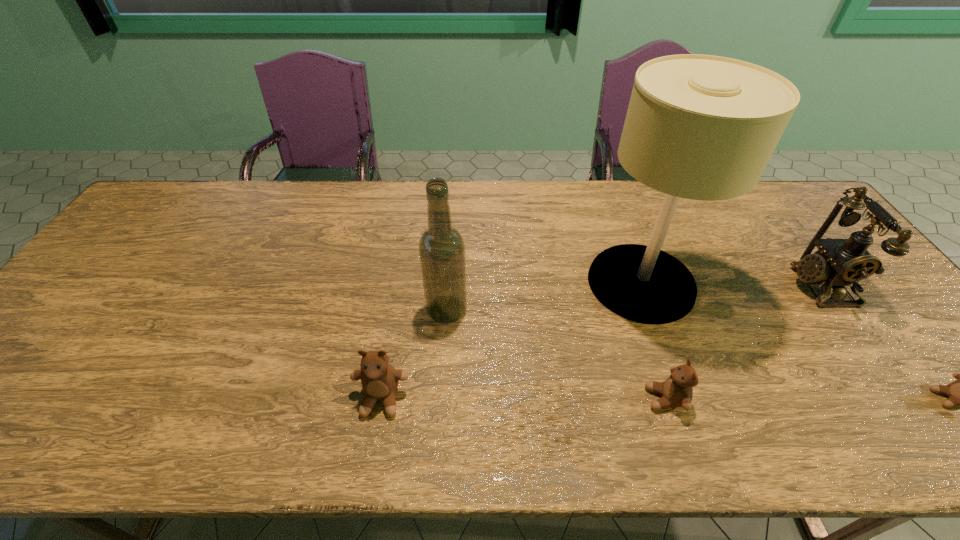
Image resolution: width=960 pixels, height=540 pixels. What are the coordinates of `object that is the fifth nearest to the third tallest object` in the screenshot? It's located at pos(379,380).

The height and width of the screenshot is (540, 960). Identify the location of teddy bear that stands as the closest to the table lamp. (676, 391).

The image size is (960, 540). Find the location of `teddy bear that stands as the second closest to the fifth tallest object`. teddy bear that stands as the second closest to the fifth tallest object is located at coordinates (959, 392).

The height and width of the screenshot is (540, 960). Find the location of `free point that satisfies the following two spatial constraints: 1. on the rotary dial of the fourth shortest object; 2. on the front-facing side of the leftmost object`. free point that satisfies the following two spatial constraints: 1. on the rotary dial of the fourth shortest object; 2. on the front-facing side of the leftmost object is located at coordinates (901, 399).

Identify the location of free space that satisfies the following two spatial constraints: 1. on the rotary dial of the telephone; 2. on the front side of the second tallest object. (837, 310).

Locate an element on the screen. The height and width of the screenshot is (540, 960). free space that satisfies the following two spatial constraints: 1. on the rotary dial of the third tallest object; 2. on the front side of the liquor is located at coordinates (837, 310).